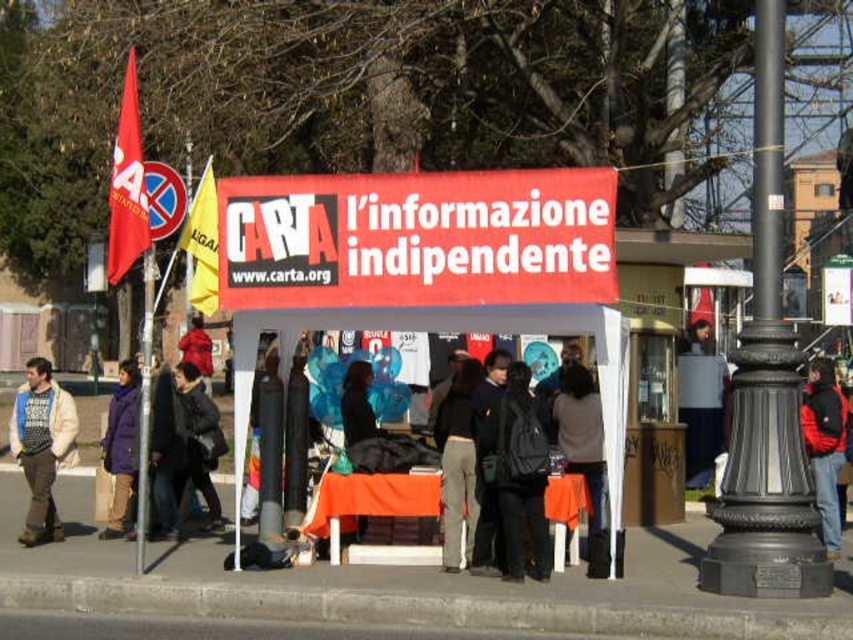
You are a pedestrian passing by the stall and notice the dark gray jacket at center and the metallic pole at upper center. Which object is shorter?

The dark gray jacket at center is shorter than the metallic pole at upper center.

You are a pedestrian walking along the sidewalk and notice the black cast iron pole at right and the matte blue sweater at left. Which object is closer to your current position?

The matte blue sweater at left is closer to your current position because the black cast iron pole at right is positioned over it, indicating it is further away.

You are a passerby who wants to pick up the dark brown leather jacket at center and the red wool coat at center from the stall. Which one should you move first to access the other?

The dark brown leather jacket at center is positioned under the red wool coat at center, so you should move the red wool coat at center first to access the dark brown leather jacket at center.